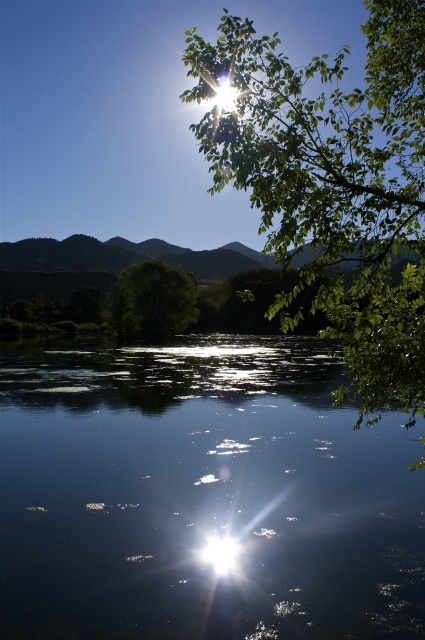
You are standing in the landscape and want to take a photo of both the transparent water at center and the green leafy tree at upper right. Which object is closer to the camera? Please explain based on their positions.

The green leafy tree at upper right is closer to the camera because it partially obscures the view of the transparent water at center, indicating it is in front of the water.

You are standing at the point labeled point (189, 310) and want to move to the point labeled point (221, 136). Which direction should you move to get closer to your destination?

You should move forward because point (221, 136) is closer to the viewer than point (189, 310).